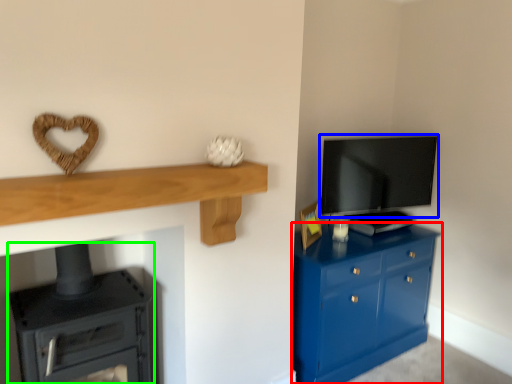
Question: Which object is the closest to the chest of drawers (highlighted by a red box)? Choose among these: television (highlighted by a blue box) or stove (highlighted by a green box).

Choices:
 (A) television
 (B) stove

Answer: (A)